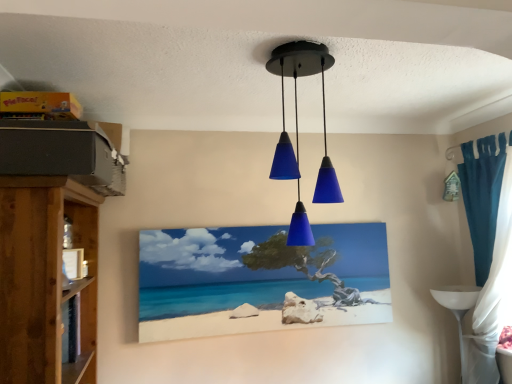
Question: Is matte blue glass pendant lights at center smaller than wooden shelf at left?

Choices:
 (A) no
 (B) yes

Answer: (B)

Question: Considering the relative positions of matte blue glass pendant lights at center and wooden shelf at left in the image provided, is matte blue glass pendant lights at center behind wooden shelf at left?

Choices:
 (A) no
 (B) yes

Answer: (B)

Question: Is matte blue glass pendant lights at center far away from wooden shelf at left?

Choices:
 (A) yes
 (B) no

Answer: (B)

Question: Can you confirm if matte blue glass pendant lights at center is wider than wooden shelf at left?

Choices:
 (A) no
 (B) yes

Answer: (A)

Question: Is matte blue glass pendant lights at center positioned in front of wooden shelf at left?

Choices:
 (A) yes
 (B) no

Answer: (B)

Question: Is matte blue glass pendant lights at center touching wooden shelf at left?

Choices:
 (A) yes
 (B) no

Answer: (B)

Question: Does white glossy table at lower right have a smaller size compared to teal fabric curtain at right?

Choices:
 (A) yes
 (B) no

Answer: (A)

Question: Is white glossy table at lower right touching teal fabric curtain at right?

Choices:
 (A) no
 (B) yes

Answer: (A)

Question: Is white glossy table at lower right outside of teal fabric curtain at right?

Choices:
 (A) yes
 (B) no

Answer: (B)

Question: Considering the relative sizes of white glossy table at lower right and teal fabric curtain at right in the image provided, is white glossy table at lower right bigger than teal fabric curtain at right?

Choices:
 (A) yes
 (B) no

Answer: (B)

Question: Considering the relative positions of white glossy table at lower right and teal fabric curtain at right in the image provided, is white glossy table at lower right to the right of teal fabric curtain at right from the viewer's perspective?

Choices:
 (A) no
 (B) yes

Answer: (A)

Question: From the image's perspective, is white glossy table at lower right on teal fabric curtain at right?

Choices:
 (A) no
 (B) yes

Answer: (A)

Question: Does teal fabric curtain at right come behind matte blue glass pendant lights at center?

Choices:
 (A) yes
 (B) no

Answer: (A)